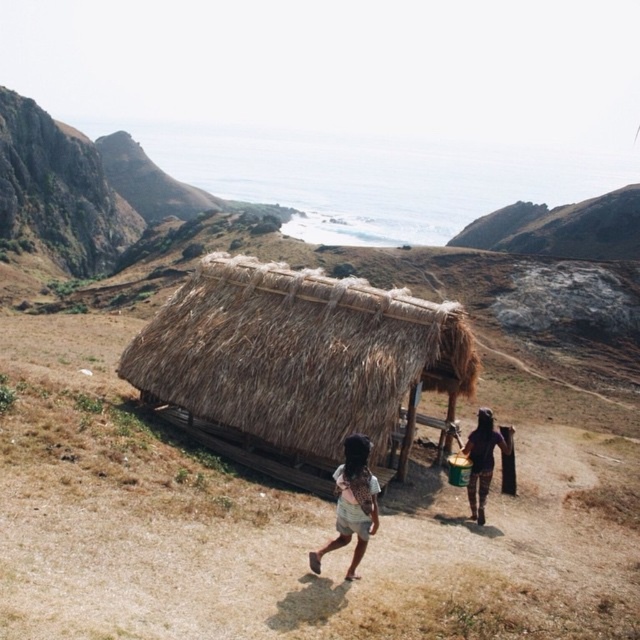
Between brown thatch hut at center and light brown fabric skirt at lower center, which one appears on the right side from the viewer's perspective?

From the viewer's perspective, light brown fabric skirt at lower center appears more on the right side.

Is point (461, 333) positioned behind point (352, 461)?

Yes, it is behind point (352, 461).

The height and width of the screenshot is (640, 640). What are the coordinates of `brown thatch hut at center` in the screenshot? It's located at (298, 365).

Looking at this image, can you confirm if brown thatch hut at center is positioned to the left of dark brown leather boots at lower right?

Yes, brown thatch hut at center is to the left of dark brown leather boots at lower right.

Is brown thatch hut at center taller than dark brown leather boots at lower right?

Correct, brown thatch hut at center is much taller as dark brown leather boots at lower right.

Is point (209, 368) less distant than point (486, 412)?

No, it is behind (486, 412).

Locate an element on the screen. The width and height of the screenshot is (640, 640). brown thatch hut at center is located at coordinates (298, 365).

Is point (337, 490) in front of point (484, 484)?

That is True.

Who is positioned more to the right, light brown fabric skirt at lower center or dark brown leather boots at lower right?

dark brown leather boots at lower right is more to the right.

Is point (360, 554) positioned after point (477, 486)?

No, it is in front of (477, 486).

I want to click on light brown fabric skirt at lower center, so tap(353, 502).